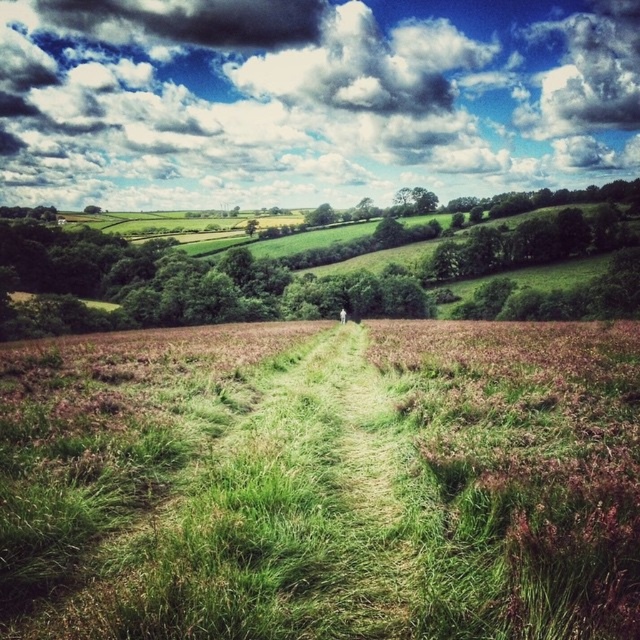
Question: Can you confirm if green grassy path at center is positioned below white fluffy cloud at upper center?

Choices:
 (A) no
 (B) yes

Answer: (B)

Question: Can you confirm if green grassy path at center is smaller than dark gray cloud at upper center?

Choices:
 (A) no
 (B) yes

Answer: (B)

Question: Which point is closer to the camera?

Choices:
 (A) white fluffy cloud at upper center
 (B) cloudy sky at upper center
 (C) green grassy path at center

Answer: (C)

Question: Which of these objects is positioned closest to the cloudy sky at upper center?

Choices:
 (A) green grassy path at center
 (B) dark gray cloud at upper center
 (C) white fabric person at center
 (D) white fluffy cloud at upper center

Answer: (D)

Question: Does cloudy sky at upper center appear over white fabric person at center?

Choices:
 (A) no
 (B) yes

Answer: (B)

Question: Which point is farther to the camera?

Choices:
 (A) (380, 76)
 (B) (292, 42)

Answer: (B)